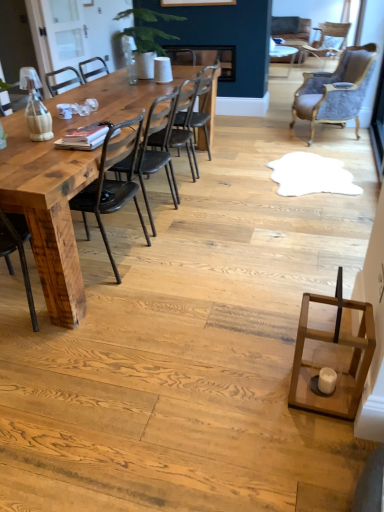
The image size is (384, 512). Describe the element at coordinates (48, 212) in the screenshot. I see `natural wood table at left` at that location.

This screenshot has height=512, width=384. What are the coordinates of `rustic wood chair at left, marked as the fifth chair in a back-to-front arrangement` in the screenshot? It's located at (112, 183).

What is the approximate width of black leather chair at center, which appears as the 3th chair when viewed from the front?

23.10 inches.

This screenshot has width=384, height=512. What are the coordinates of `black leather chair at center, the third chair in the left-to-right sequence` in the screenshot? It's located at (184, 122).

I want to click on velvet grey armchair at upper right, placed as the 2th chair when sorted from right to left, so click(x=336, y=91).

Identify the location of metallic black chair at center, the 2th chair when ordered from left to right. This screenshot has width=384, height=512. (157, 150).

This screenshot has width=384, height=512. I want to click on natural wood table at left, so click(48, 212).

Can we say velvet grey armchair at upper right, placed as the 2th chair when sorted from back to front, lies outside wooden chair at upper right, the 5th chair viewed from the left?

Yes.

Between velvet grey armchair at upper right, placed as the 2th chair when sorted from back to front, and wooden chair at upper right, the first chair viewed from the top, which one has more height?

velvet grey armchair at upper right, placed as the 2th chair when sorted from back to front, is taller.

Looking at this image, considering the sizes of objects velvet grey armchair at upper right, arranged as the fourth chair when viewed from the front, and wooden chair at upper right, marked as the first chair in a right-to-left arrangement, in the image provided, who is wider, velvet grey armchair at upper right, arranged as the fourth chair when viewed from the front, or wooden chair at upper right, marked as the first chair in a right-to-left arrangement,?

Wider between the two is wooden chair at upper right, marked as the first chair in a right-to-left arrangement.

Is velvet grey armchair at upper right, the second chair when ordered from top to bottom, with wooden chair at upper right, the 5th chair viewed from the left?

They are not placed beside each other.

Does wooden chair at upper right, arranged as the 5th chair when viewed from the front, come behind natural wood table at left?

Yes, wooden chair at upper right, arranged as the 5th chair when viewed from the front, is further from the viewer.

Considering the relative sizes of wooden chair at upper right, the first chair viewed from the top, and natural wood table at left in the image provided, is wooden chair at upper right, the first chair viewed from the top, shorter than natural wood table at left?

Yes, wooden chair at upper right, the first chair viewed from the top, is shorter than natural wood table at left.

Considering the relative sizes of wooden chair at upper right, marked as the first chair in a right-to-left arrangement, and natural wood table at left in the image provided, is wooden chair at upper right, marked as the first chair in a right-to-left arrangement, thinner than natural wood table at left?

Indeed, wooden chair at upper right, marked as the first chair in a right-to-left arrangement, has a lesser width compared to natural wood table at left.

Visually, is wooden chair at upper right, the 5th chair viewed from the left, positioned to the left or to the right of natural wood table at left?

Clearly, wooden chair at upper right, the 5th chair viewed from the left, is on the right of natural wood table at left in the image.

Which object is wider, wooden chair at upper right, arranged as the 5th chair when viewed from the front, or metallic black chair at center, the fourth chair positioned from the right?

Wider between the two is wooden chair at upper right, arranged as the 5th chair when viewed from the front.

Is wooden chair at upper right, the 5th chair viewed from the left, with metallic black chair at center, the fourth chair positioned from the back?

They are not placed beside each other.

From a real-world perspective, which is physically below, wooden chair at upper right, marked as the first chair in a right-to-left arrangement, or metallic black chair at center, the fourth chair positioned from the right?

wooden chair at upper right, marked as the first chair in a right-to-left arrangement, is physically lower.

Which is behind, wooden chair at upper right, the 1th chair positioned from the back, or metallic black chair at center, the fourth chair positioned from the right?

wooden chair at upper right, the 1th chair positioned from the back, is further from the camera.

Would you say rustic wood chair at left, placed as the first chair when sorted from left to right, is outside black leather chair at center, which appears as the 3th chair when viewed from the front?

rustic wood chair at left, placed as the first chair when sorted from left to right, is positioned outside black leather chair at center, which appears as the 3th chair when viewed from the front.

Is rustic wood chair at left, acting as the 1th chair starting from the bottom, bigger than black leather chair at center, arranged as the 3th chair when ordered from the bottom?

Correct, rustic wood chair at left, acting as the 1th chair starting from the bottom, is larger in size than black leather chair at center, arranged as the 3th chair when ordered from the bottom.

How different are the orientations of rustic wood chair at left, placed as the first chair when sorted from left to right, and black leather chair at center, which appears as the 3th chair when viewed from the front, in degrees?

0.000614 degrees separate the facing orientations of rustic wood chair at left, placed as the first chair when sorted from left to right, and black leather chair at center, which appears as the 3th chair when viewed from the front.

Is point (173, 105) positioned after point (15, 113)?

Yes, it is behind point (15, 113).

Which object is wider, metallic black chair at center, the fourth chair positioned from the right, or natural wood table at left?

natural wood table at left is wider.

Is natural wood table at left a part of metallic black chair at center, the 2th chair when ordered from left to right?

Definitely not — natural wood table at left is not inside metallic black chair at center, the 2th chair when ordered from left to right.

What's the angular difference between metallic black chair at center, the 2th chair when ordered from left to right, and natural wood table at left's facing directions?

91.7 degrees.

Considering the relative positions of natural wood table at left and velvet grey armchair at upper right, placed as the 2th chair when sorted from right to left, in the image provided, is natural wood table at left to the left of velvet grey armchair at upper right, placed as the 2th chair when sorted from right to left, from the viewer's perspective?

Correct, you'll find natural wood table at left to the left of velvet grey armchair at upper right, placed as the 2th chair when sorted from right to left.

Looking at this image, from the image's perspective, which is above, natural wood table at left or velvet grey armchair at upper right, placed as the 2th chair when sorted from right to left?

velvet grey armchair at upper right, placed as the 2th chair when sorted from right to left, is shown above in the image.

Is natural wood table at left not near velvet grey armchair at upper right, arranged as the fourth chair when viewed from the front?

Yes, natural wood table at left and velvet grey armchair at upper right, arranged as the fourth chair when viewed from the front, are located far from each other.

From the image's perspective, does black leather chair at center, placed as the third chair when sorted from back to front, appear lower than wooden chair at upper right, the first chair viewed from the top?

Yes, from the image's perspective, black leather chair at center, placed as the third chair when sorted from back to front, is beneath wooden chair at upper right, the first chair viewed from the top.

Is point (190, 109) less distant than point (350, 25)?

Yes, it is.

The image size is (384, 512). I want to click on the 2nd chair below the wooden chair at upper right, the 1th chair positioned from the back (from the image's perspective), so click(184, 122).

Would you say black leather chair at center, the third chair in the left-to-right sequence, is inside or outside wooden chair at upper right, the fifth chair positioned from the bottom?

black leather chair at center, the third chair in the left-to-right sequence, is not inside wooden chair at upper right, the fifth chair positioned from the bottom, it's outside.

Image resolution: width=384 pixels, height=512 pixels. What are the coordinates of `the 1st chair in front of the wooden chair at upper right, marked as the first chair in a right-to-left arrangement` in the screenshot? It's located at (336, 91).

Where is `kitchen & dining room table below the wooden chair at upper right, the first chair viewed from the top (from a real-world perspective)`? Image resolution: width=384 pixels, height=512 pixels. kitchen & dining room table below the wooden chair at upper right, the first chair viewed from the top (from a real-world perspective) is located at coordinates (48, 212).

Looking at the image, which one is located closer to velvet grey armchair at upper right, the second chair when ordered from top to bottom, black leather chair at center, arranged as the 3th chair when ordered from the bottom, or metallic black chair at center, the second chair viewed from the front?

The object closer to velvet grey armchair at upper right, the second chair when ordered from top to bottom, is black leather chair at center, arranged as the 3th chair when ordered from the bottom.

When comparing their distances from black leather chair at center, which is the third chair in right-to-left order, does wooden chair at upper right, the 5th chair viewed from the left, or rustic wood chair at left, marked as the fifth chair in a back-to-front arrangement, seem further?

wooden chair at upper right, the 5th chair viewed from the left.

In the scene shown: Estimate the real-world distances between objects in this image. Which object is further from natural wood table at left, wooden chair at upper right, arranged as the 5th chair when viewed from the front, or metallic black chair at center, marked as the fourth chair in a top-to-bottom arrangement?

Based on the image, wooden chair at upper right, arranged as the 5th chair when viewed from the front, appears to be further to natural wood table at left.

Based on their spatial positions, is metallic black chair at center, the second chair viewed from the front, or wooden chair at upper right, the fifth chair positioned from the bottom, closer to black leather chair at center, the third chair in the left-to-right sequence?

metallic black chair at center, the second chair viewed from the front.

From the image, which object appears to be farther from rustic wood chair at left, which ranks as the fifth chair in right-to-left order, velvet grey armchair at upper right, placed as the 2th chair when sorted from right to left, or wooden chair at upper right, arranged as the 5th chair when viewed from the front?

wooden chair at upper right, arranged as the 5th chair when viewed from the front, is further to rustic wood chair at left, which ranks as the fifth chair in right-to-left order.

Considering their positions, is metallic black chair at center, the second chair viewed from the front, positioned further to velvet grey armchair at upper right, placed as the 2th chair when sorted from back to front, than wooden chair at upper right, the 1th chair positioned from the back?

The object further to velvet grey armchair at upper right, placed as the 2th chair when sorted from back to front, is metallic black chair at center, the second chair viewed from the front.

Looking at the image, which one is located closer to natural wood table at left, velvet grey armchair at upper right, placed as the 2th chair when sorted from back to front, or rustic wood chair at left, marked as the fifth chair in a back-to-front arrangement?

Based on the image, rustic wood chair at left, marked as the fifth chair in a back-to-front arrangement, appears to be nearer to natural wood table at left.

Estimate the real-world distances between objects in this image. Which object is closer to rustic wood chair at left, the 1th chair in the front-to-back sequence, velvet grey armchair at upper right, placed as the 2th chair when sorted from right to left, or natural wood table at left?

natural wood table at left is closer to rustic wood chair at left, the 1th chair in the front-to-back sequence.

The image size is (384, 512). Find the location of `chair between metallic black chair at center, the second chair viewed from the front, and velvet grey armchair at upper right, placed as the 2th chair when sorted from back to front`. chair between metallic black chair at center, the second chair viewed from the front, and velvet grey armchair at upper right, placed as the 2th chair when sorted from back to front is located at coordinates (184, 122).

The width and height of the screenshot is (384, 512). I want to click on chair between rustic wood chair at left, the 1th chair in the front-to-back sequence, and black leather chair at center, placed as the third chair when sorted from back to front, along the z-axis, so click(x=157, y=150).

Image resolution: width=384 pixels, height=512 pixels. Identify the location of chair between black leather chair at center, the third chair in the left-to-right sequence, and wooden chair at upper right, the 5th chair viewed from the left, in the front-back direction. (336, 91).

Image resolution: width=384 pixels, height=512 pixels. Find the location of `chair located between natural wood table at left and metallic black chair at center, the fourth chair positioned from the right, in the depth direction`. chair located between natural wood table at left and metallic black chair at center, the fourth chair positioned from the right, in the depth direction is located at coordinates (112, 183).